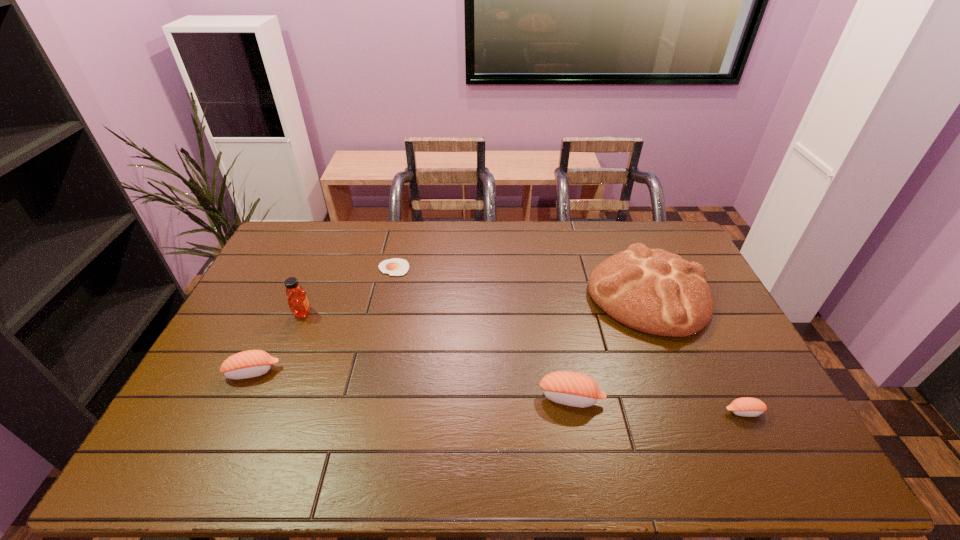
Find the location of a particular element. The image size is (960, 540). the third nearest object is located at coordinates (252, 363).

The image size is (960, 540). What are the coordinates of `the farthest sushi` in the screenshot? It's located at (252, 363).

You are a GUI agent. You are given a task and a screenshot of the screen. Output one action in this format:
    pyautogui.click(x=<x>, y=<y>)
    Task: Click on the second sushi from left to right
    
    Given the screenshot: What is the action you would take?
    pyautogui.click(x=575, y=389)

You are a GUI agent. You are given a task and a screenshot of the screen. Output one action in this format:
    pyautogui.click(x=<x>, y=<y>)
    Task: Click on the fifth tallest object
    
    Given the screenshot: What is the action you would take?
    pyautogui.click(x=748, y=407)

At what (x,y) coordinates should I click in order to perform the action: click on the rightmost sushi. Please return your answer as a coordinate pair (x, y). The height and width of the screenshot is (540, 960). Looking at the image, I should click on 748,407.

Locate an element on the screen. This screenshot has width=960, height=540. the shortest object is located at coordinates (394, 267).

At what (x,y) coordinates should I click in order to perform the action: click on egg yolk. Please return your answer as a coordinate pair (x, y). Looking at the image, I should click on (394, 267).

The width and height of the screenshot is (960, 540). What are the coordinates of `honey` in the screenshot? It's located at (298, 302).

The width and height of the screenshot is (960, 540). Find the location of `bread`. bread is located at coordinates (656, 292).

The width and height of the screenshot is (960, 540). I want to click on vacant space located 0.320m on the right of the fourth tallest object, so click(394, 372).